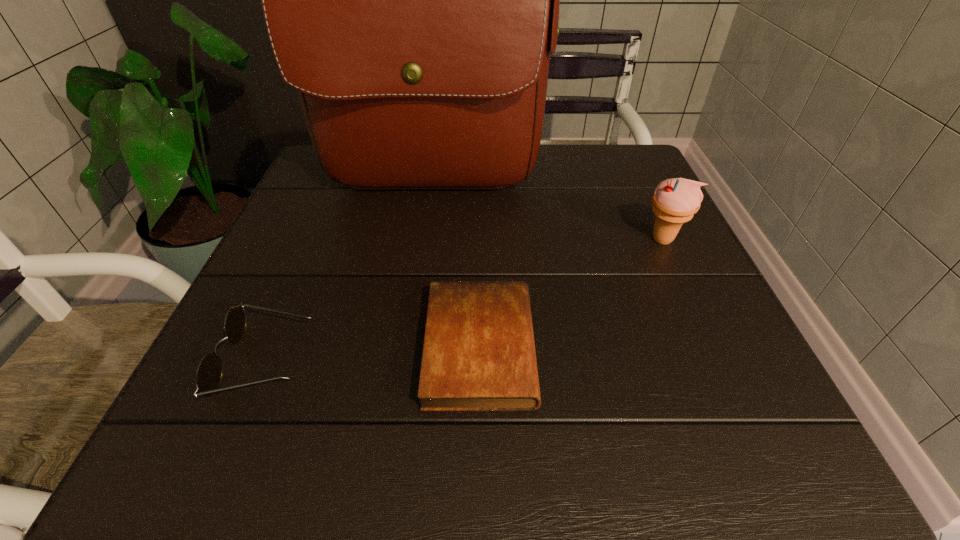
Where is `object that is at the far edge`? object that is at the far edge is located at coordinates (412, 0).

Find the location of a particular element. spectacles that is at the near edge is located at coordinates (209, 373).

The width and height of the screenshot is (960, 540). I want to click on Bible at the near edge, so click(479, 354).

At what (x,y) coordinates should I click in order to perform the action: click on satchel at the left edge. Please return your answer as a coordinate pair (x, y). This screenshot has width=960, height=540. Looking at the image, I should click on (412, 0).

The height and width of the screenshot is (540, 960). Identify the location of spectacles present at the left edge. (209, 373).

Identify the location of object that is at the right edge. The image size is (960, 540). (675, 201).

Locate an element on the screen. object present at the far left corner is located at coordinates tap(412, 0).

Image resolution: width=960 pixels, height=540 pixels. What are the coordinates of `object located at the near left corner` in the screenshot? It's located at (209, 373).

You are a GUI agent. You are given a task and a screenshot of the screen. Output one action in this format:
    pyautogui.click(x=<x>, y=<y>)
    Task: Click on the free space at the near edge of the desktop
    
    Given the screenshot: What is the action you would take?
    pyautogui.click(x=635, y=424)

What are the coordinates of `vacant space at the left edge` in the screenshot? It's located at [248, 402].